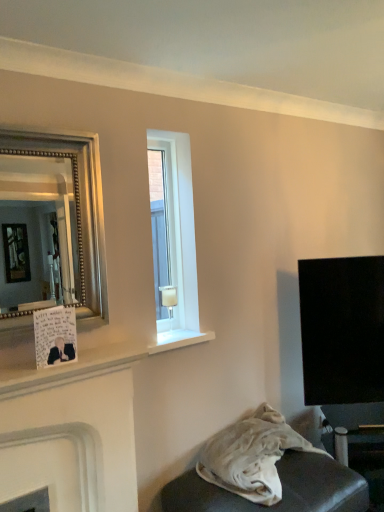
Locate an element on the screen. white fabric at lower right is located at coordinates [x=265, y=473].

Is the position of clear glass window at center more distant than that of white matte fireplace at lower left?

Yes.

How many degrees apart are the facing directions of clear glass window at center and white matte fireplace at lower left?

They differ by 0.0804 degrees in their facing directions.

Could you tell me if clear glass window at center is facing white matte fireplace at lower left?

No, clear glass window at center does not turn towards white matte fireplace at lower left.

Considering the points (158, 162) and (120, 469), which point is behind, point (158, 162) or point (120, 469)?

Point (158, 162)

Could you tell me if clear glass window at center is facing white fabric at lower right?

No, clear glass window at center is not facing towards white fabric at lower right.

From the image's perspective, is clear glass window at center above or below white fabric at lower right?

Based on their image positions, clear glass window at center is located above white fabric at lower right.

Is the depth of clear glass window at center greater than that of white fabric at lower right?

That is True.

I want to click on window that appears above the white fabric at lower right (from a real-world perspective), so click(164, 230).

How different are the orientations of white fabric at lower right and white matte fireplace at lower left in degrees?

The facing directions of white fabric at lower right and white matte fireplace at lower left are 0.673 degrees apart.

Visually, is white fabric at lower right positioned to the left or to the right of white matte fireplace at lower left?

From the image, it's evident that white fabric at lower right is to the right of white matte fireplace at lower left.

The width and height of the screenshot is (384, 512). Identify the location of fireplace on the left side of white fabric at lower right. (73, 443).

Which point is more forward, (229, 449) or (122, 428)?

The point (122, 428) is more forward.

Is white fabric at lower right positioned before silver beaded mirror at left?

No, white fabric at lower right is further to the viewer.

Which point is more distant from viewer, (294,444) or (49,192)?

The point (49,192) is more distant.

Considering the relative sizes of white fabric at lower right and silver beaded mirror at left in the image provided, is white fabric at lower right bigger than silver beaded mirror at left?

Yes, white fabric at lower right is bigger than silver beaded mirror at left.

From the picture: From their relative heights in the image, would you say white fabric at lower right is taller or shorter than silver beaded mirror at left?

white fabric at lower right is shorter than silver beaded mirror at left.

Is silver beaded mirror at left placed right next to white matte fireplace at lower left?

silver beaded mirror at left is not next to white matte fireplace at lower left, and they're not touching.

Is silver beaded mirror at left inside the boundaries of white matte fireplace at lower left, or outside?

silver beaded mirror at left cannot be found inside white matte fireplace at lower left.

You are a GUI agent. You are given a task and a screenshot of the screen. Output one action in this format:
    pyautogui.click(x=<x>, y=<y>)
    Task: Click on the fireplace below the silver beaded mirror at left (from a real-world perspective)
    This screenshot has width=384, height=512.
    Given the screenshot: What is the action you would take?
    pyautogui.click(x=73, y=443)

Is silver beaded mirror at left taller than white matte fireplace at lower left?

No.

Can you confirm if silver beaded mirror at left is taller than white fabric at lower right?

Indeed, silver beaded mirror at left has a greater height compared to white fabric at lower right.

Is point (63, 187) closer or farther from the camera than point (219, 436)?

Point (63, 187) appears to be farther away from the viewer than point (219, 436).

Considering the relative sizes of silver beaded mirror at left and white fabric at lower right in the image provided, is silver beaded mirror at left thinner than white fabric at lower right?

Yes, silver beaded mirror at left is thinner than white fabric at lower right.

From the image's perspective, is silver beaded mirror at left positioned above or below white fabric at lower right?

From the image's perspective, silver beaded mirror at left appears above white fabric at lower right.

Is clear glass window at center completely or partially inside white fabric at lower right?

That's incorrect, clear glass window at center is not inside white fabric at lower right.

From the image's perspective, would you say white fabric at lower right is positioned over clear glass window at center?

Actually, white fabric at lower right appears below clear glass window at center in the image.

Consider the image. Is white fabric at lower right oriented away from clear glass window at center?

No.

The image size is (384, 512). Identify the location of window above the white matte fireplace at lower left (from a real-world perspective). point(164,230).

At what (x,y) coordinates should I click in order to perform the action: click on furniture in front of the clear glass window at center. Please return your answer as a coordinate pair (x, y). This screenshot has width=384, height=512. Looking at the image, I should click on (265, 473).

Based on their spatial positions, is silver beaded mirror at left or white fabric at lower right closer to white matte fireplace at lower left?

white fabric at lower right lies closer to white matte fireplace at lower left than the other object.

Considering their positions, is white matte fireplace at lower left positioned closer to white fabric at lower right than silver beaded mirror at left?

Based on the image, white matte fireplace at lower left appears to be nearer to white fabric at lower right.

When comparing their distances from clear glass window at center, does white fabric at lower right or white matte fireplace at lower left seem further?

white fabric at lower right.

When comparing their distances from white fabric at lower right, does clear glass window at center or silver beaded mirror at left seem closer?

clear glass window at center lies closer to white fabric at lower right than the other object.

When comparing their distances from white fabric at lower right, does white matte fireplace at lower left or clear glass window at center seem closer?

white matte fireplace at lower left is positioned closer to the anchor white fabric at lower right.

Based on their spatial positions, is white fabric at lower right or clear glass window at center closer to silver beaded mirror at left?

clear glass window at center.

Estimate the real-world distances between objects in this image. Which object is further from clear glass window at center, white fabric at lower right or silver beaded mirror at left?

The object further to clear glass window at center is silver beaded mirror at left.

Which object lies nearer to the anchor point silver beaded mirror at left, white matte fireplace at lower left or white fabric at lower right?

white matte fireplace at lower left lies closer to silver beaded mirror at left than the other object.

Locate an element on the screen. mirror between clear glass window at center and white matte fireplace at lower left vertically is located at coordinates (27, 242).

Where is `mirror between clear glass window at center and white fabric at lower right vertically`? The width and height of the screenshot is (384, 512). mirror between clear glass window at center and white fabric at lower right vertically is located at coordinates (27, 242).

The height and width of the screenshot is (512, 384). In order to click on fireplace between clear glass window at center and white fabric at lower right vertically in this screenshot , I will do `click(73, 443)`.

Where is `fireplace between silver beaded mirror at left and white fabric at lower right in the up-down direction`? The width and height of the screenshot is (384, 512). fireplace between silver beaded mirror at left and white fabric at lower right in the up-down direction is located at coordinates (73, 443).